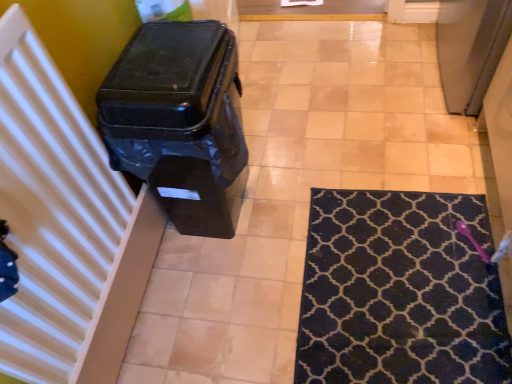
Question: Is navy blue textured rug at lower right to the left or to the right of white striped radiator at left in the image?

Choices:
 (A) left
 (B) right

Answer: (B)

Question: From a real-world perspective, is navy blue textured rug at lower right above or below white striped radiator at left?

Choices:
 (A) above
 (B) below

Answer: (B)

Question: Which is farther from the white striped radiator at left?

Choices:
 (A) navy blue textured rug at lower right
 (B) black plastic waste container at left

Answer: (A)

Question: Estimate the real-world distances between objects in this image. Which object is closer to the black plastic waste container at left?

Choices:
 (A) white striped radiator at left
 (B) navy blue textured rug at lower right

Answer: (A)